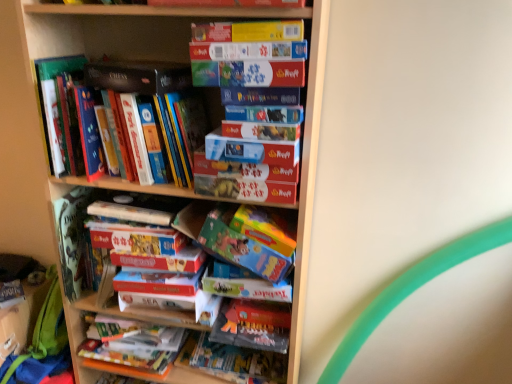
Question: Can you confirm if hardcover book at upper left, the 1th book from the top, is smaller than matte cardboard book at upper center, which appears as the 7th paperback book when ordered from the bottom?

Choices:
 (A) yes
 (B) no

Answer: (B)

Question: From a real-world perspective, is hardcover book at upper left, the 2th book positioned from the bottom, under matte cardboard book at upper center, the second paperback book from the top?

Choices:
 (A) no
 (B) yes

Answer: (B)

Question: Does hardcover book at upper left, the 1th book from the top, have a larger size compared to matte cardboard book at upper center, the second paperback book from the top?

Choices:
 (A) yes
 (B) no

Answer: (A)

Question: Considering the relative sizes of hardcover book at upper left, the 1th book from the top, and matte cardboard book at upper center, which appears as the 7th paperback book when ordered from the bottom, in the image provided, is hardcover book at upper left, the 1th book from the top, wider than matte cardboard book at upper center, which appears as the 7th paperback book when ordered from the bottom,?

Choices:
 (A) no
 (B) yes

Answer: (B)

Question: From the image's perspective, is hardcover book at upper left, the 2th book positioned from the bottom, on top of matte cardboard book at upper center, which appears as the 7th paperback book when ordered from the bottom?

Choices:
 (A) no
 (B) yes

Answer: (A)

Question: Looking at their shapes, would you say matte black book at upper left, which is counted as the sixth paperback book, starting from the bottom, is wider or thinner than hardcover book at upper left, the 1th book from the top?

Choices:
 (A) thin
 (B) wide

Answer: (B)

Question: From the image's perspective, is matte black book at upper left, which is counted as the sixth paperback book, starting from the bottom, positioned above or below hardcover book at upper left, the 1th book from the top?

Choices:
 (A) above
 (B) below

Answer: (A)

Question: In terms of height, does matte black book at upper left, the third paperback book in the top-to-bottom sequence, look taller or shorter compared to hardcover book at upper left, the 1th book from the top?

Choices:
 (A) short
 (B) tall

Answer: (A)

Question: Considering the relative positions of matte black book at upper left, the third paperback book in the top-to-bottom sequence, and hardcover book at upper left, the 2th book positioned from the bottom, in the image provided, is matte black book at upper left, the third paperback book in the top-to-bottom sequence, to the left or to the right of hardcover book at upper left, the 2th book positioned from the bottom,?

Choices:
 (A) right
 (B) left

Answer: (A)

Question: From a real-world perspective, is matte cardboard book at center, the 3th paperback book when ordered from bottom to top, positioned above or below matte black book at upper left, the third paperback book in the top-to-bottom sequence?

Choices:
 (A) below
 (B) above

Answer: (A)

Question: Considering the positions of matte cardboard book at center, the sixth paperback book from the top, and matte black book at upper left, the third paperback book in the top-to-bottom sequence, in the image, is matte cardboard book at center, the sixth paperback book from the top, taller or shorter than matte black book at upper left, the third paperback book in the top-to-bottom sequence,?

Choices:
 (A) short
 (B) tall

Answer: (B)

Question: Is point (x=271, y=142) closer or farther from the camera than point (x=126, y=81)?

Choices:
 (A) closer
 (B) farther

Answer: (A)

Question: Based on their positions, is matte cardboard book at center, the 3th paperback book when ordered from bottom to top, located to the left or right of matte black book at upper left, which is counted as the sixth paperback book, starting from the bottom?

Choices:
 (A) right
 (B) left

Answer: (A)

Question: In the image, is matte cardboard book at center, which ranks as the fourth paperback book in top-to-bottom order, positioned in front of or behind matte cardboard book at upper center, the second paperback book from the top?

Choices:
 (A) behind
 (B) front

Answer: (A)

Question: In terms of height, does matte cardboard book at center, which ranks as the fourth paperback book in top-to-bottom order, look taller or shorter compared to matte cardboard book at upper center, which appears as the 7th paperback book when ordered from the bottom?

Choices:
 (A) short
 (B) tall

Answer: (B)